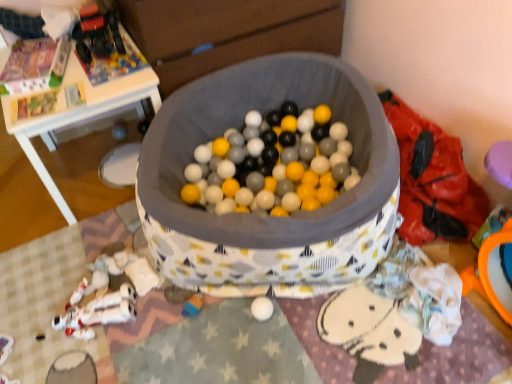
At what (x,y) coordinates should I click in order to perform the action: click on free space that is in between white plastic toy at lower left, placed as the third toy when sorted from top to bottom, and rubberized plastic toy at lower center, the fourth toy viewed from the top. Please return your answer as a coordinate pair (x, y). Looking at the image, I should click on (155, 311).